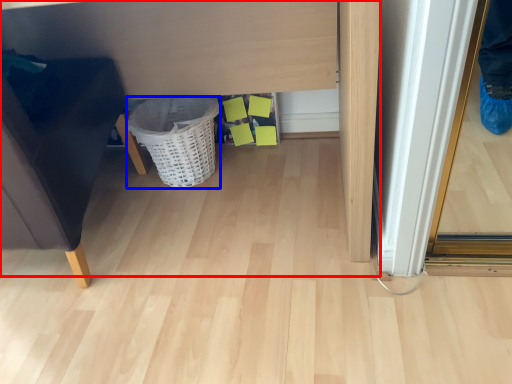
Question: Among these objects, which one is farthest to the camera, vanity (highlighted by a red box) or basket (highlighted by a blue box)?

Choices:
 (A) vanity
 (B) basket

Answer: (B)